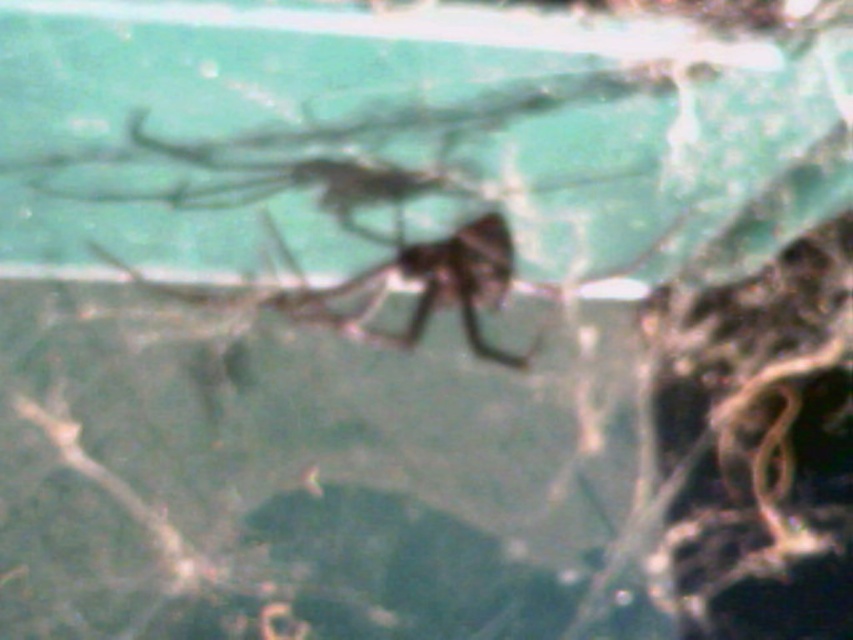
Based on the photo, you are an entomologist examining two spiders in a close proximity. You have the shiny black spider at center and the shiny brown spider at center. Which spider has a taller body?

The shiny black spider at center has a greater height compared to the shiny brown spider at center, so the shiny black spider at center is taller.

You are an entomologist observing two spiders in a natural setting. You notice a shiny black spider at center and a shiny brown spider at center. Which spider is closer to you?

The shiny black spider at center is closer to you because it is in front of the shiny brown spider at center.

You are a bug collector who needs to capture both spiders without letting them escape. The jar you have can only hold one spider at a time. If you start at the shiny black spider at center, which direction should you move to reach the shiny brown spider at center?

The shiny brown spider at center is 2.68 inches away from the shiny black spider at center. Since you need to capture both spiders one at a time, you should move towards the shiny brown spider at center in the direction where they are separated by that distance.